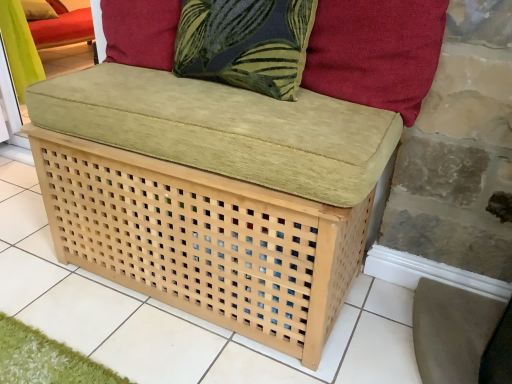
Question: From a real-world perspective, is suede-like red cushion at upper right, the 2th pillow viewed from the left, above or below dark blue fabric pillow at upper center?

Choices:
 (A) above
 (B) below

Answer: (A)

Question: Considering the positions of suede-like red cushion at upper right, marked as the 2th pillow in a top-to-bottom arrangement, and dark blue fabric pillow at upper center in the image, is suede-like red cushion at upper right, marked as the 2th pillow in a top-to-bottom arrangement, taller or shorter than dark blue fabric pillow at upper center?

Choices:
 (A) tall
 (B) short

Answer: (A)

Question: Which of these objects is positioned closest to the suede-like red cushion at upper right, which appears as the first pillow when ordered from the bottom?

Choices:
 (A) velvet cushion at upper left, which appears as the second pillow when viewed from the right
 (B) dark blue fabric pillow at upper center

Answer: (B)

Question: Estimate the real-world distances between objects in this image. Which object is closer to the suede-like red cushion at upper right, the 2th pillow viewed from the left?

Choices:
 (A) velvet cushion at upper left, acting as the 1th pillow starting from the top
 (B) dark blue fabric pillow at upper center

Answer: (B)